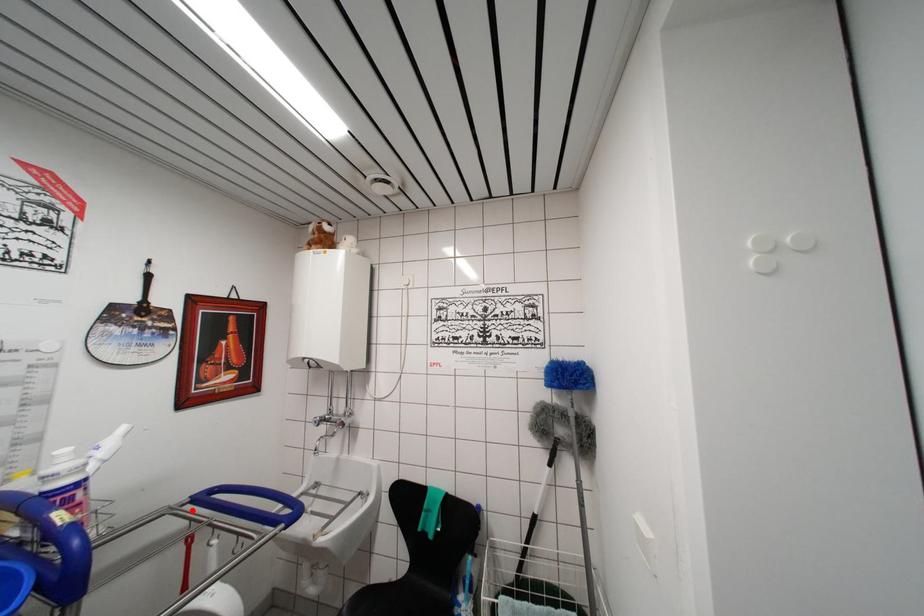
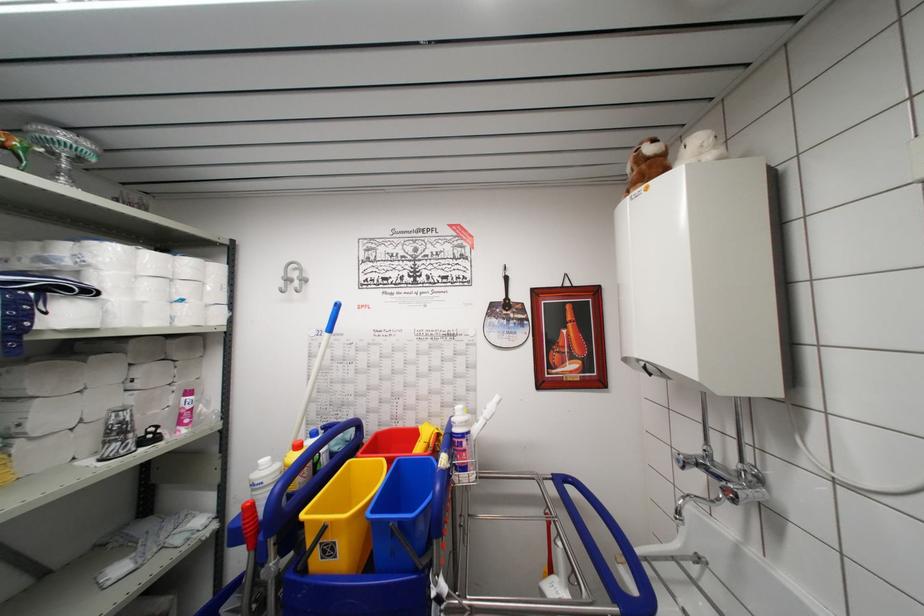
In the second image, find the point that corresponds to the highlighted location in the first image.

(554, 487)